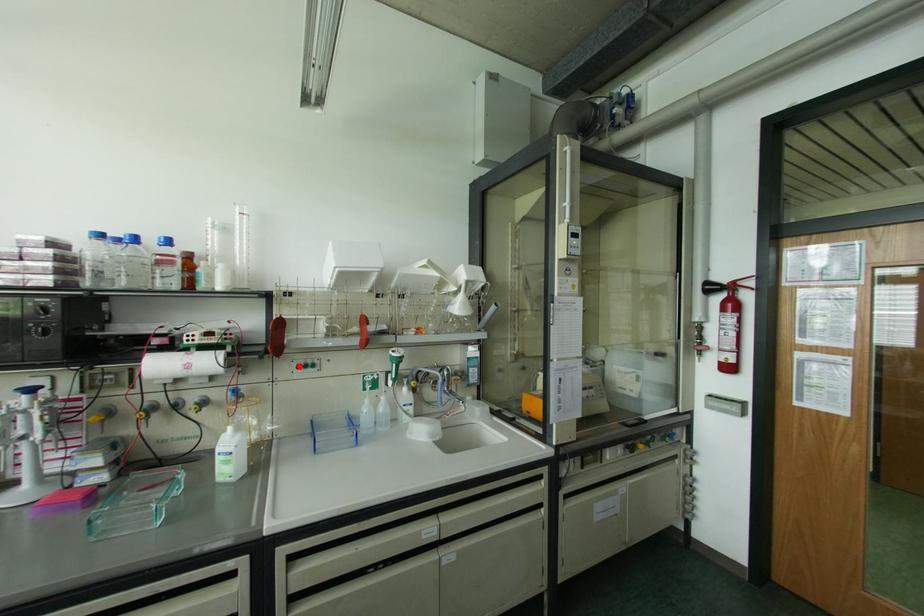
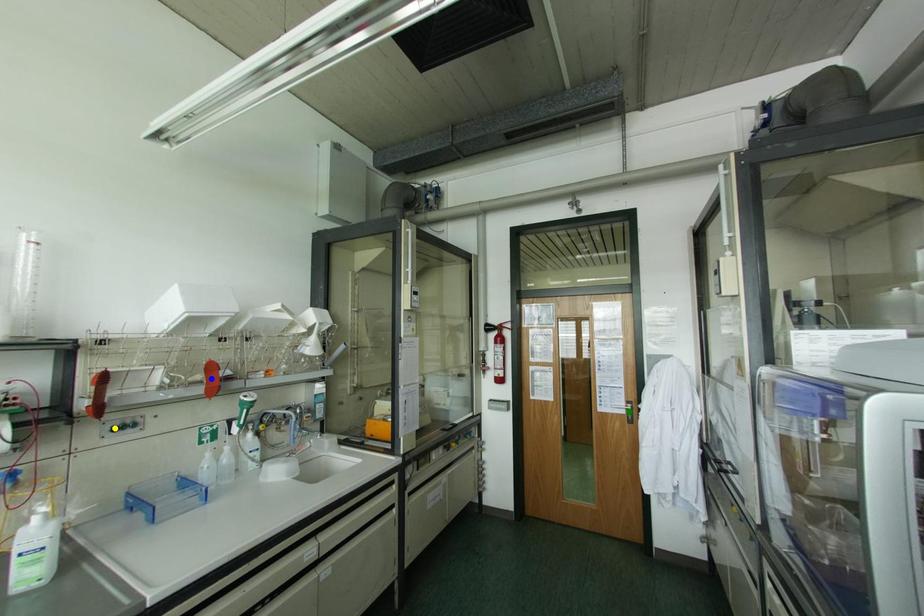
Question: I am providing you with two images of the same scene from different viewpoints. A red point is marked on the first image. You are given multiple points on the second image. Can you choose the point in image 2 that corresponds to the point in image 1?

Choices:
 (A) blue point
 (B) green point
 (C) yellow point

Answer: (C)